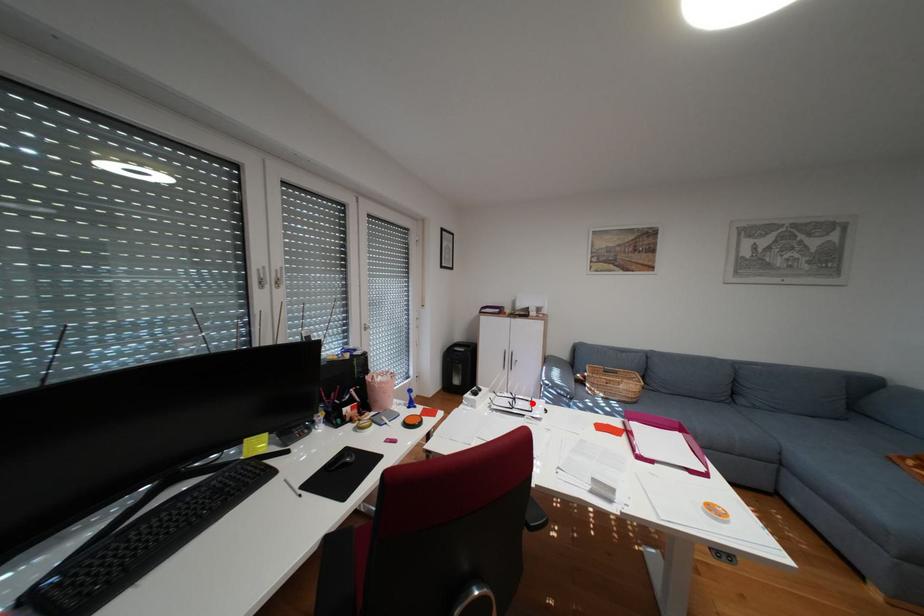
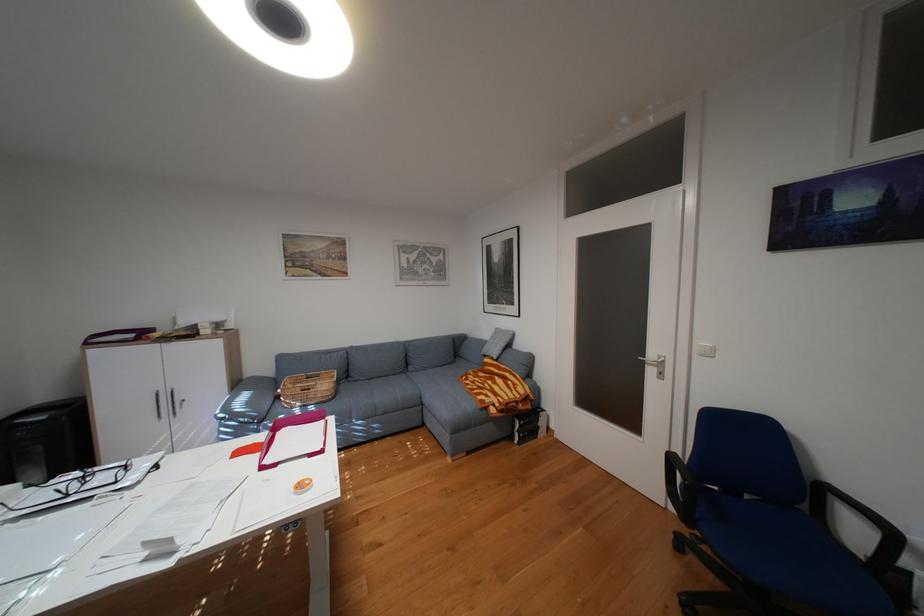
Locate, in the second image, the point that corresponds to the highlighted location in the first image.

(114, 477)